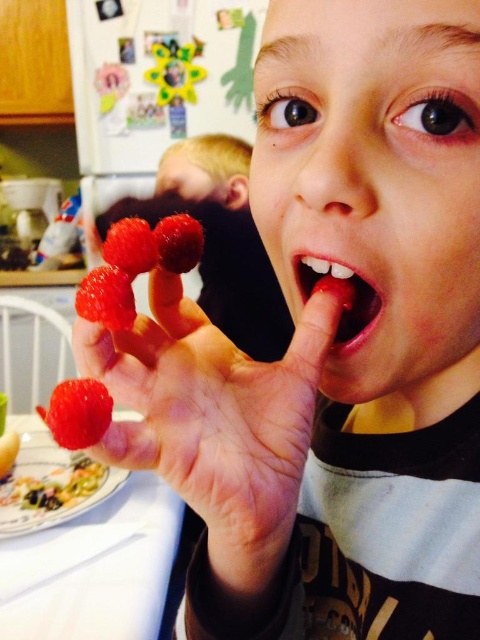
Does shiny red raspberries at center appear on the left side of shiny red strawberry at center?

No, shiny red raspberries at center is not to the left of shiny red strawberry at center.

Who is more forward, (335, 294) or (112, 225)?

Positioned in front is point (335, 294).

You are a GUI agent. You are given a task and a screenshot of the screen. Output one action in this format:
    pyautogui.click(x=<x>, y=<y>)
    Task: Click on the shiny red raspberries at center
    The width and height of the screenshot is (480, 640).
    Given the screenshot: What is the action you would take?
    pyautogui.click(x=215, y=410)

Where is `shiny red raspberries at center`? shiny red raspberries at center is located at coordinates (215, 410).

Is porcelain plate at lower left to the left of glossy red strawberry at center from the viewer's perspective?

Yes, porcelain plate at lower left is to the left of glossy red strawberry at center.

From the picture: Does porcelain plate at lower left have a larger size compared to glossy red strawberry at center?

Yes.

The width and height of the screenshot is (480, 640). What do you see at coordinates (49, 481) in the screenshot? I see `porcelain plate at lower left` at bounding box center [49, 481].

Where is `porcelain plate at lower left`? porcelain plate at lower left is located at coordinates (49, 481).

Between white glossy plate at lower left and glossy red strawberry at center, which one is positioned higher?

glossy red strawberry at center

The width and height of the screenshot is (480, 640). Identify the location of white glossy plate at lower left. (95, 568).